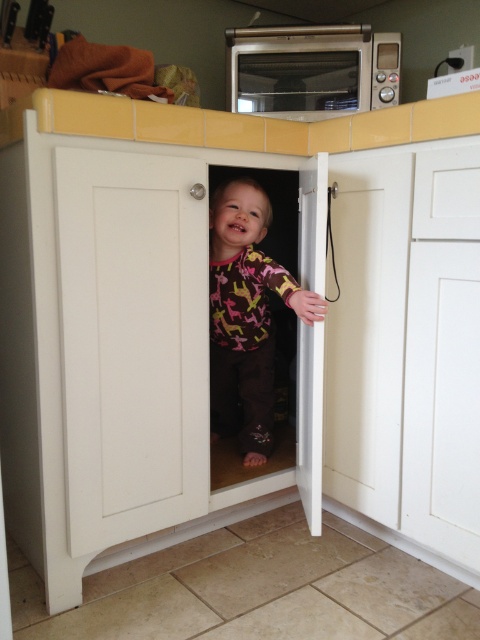
Is multicolored fabric baby at center closer to camera compared to satin silver microwave at upper center?

Yes, it is in front of satin silver microwave at upper center.

Between multicolored fabric baby at center and satin silver microwave at upper center, which one is positioned higher?

satin silver microwave at upper center is higher up.

Which is behind, point (239, 182) or point (250, 67)?

The point (250, 67) is behind.

This screenshot has width=480, height=640. What are the coordinates of `multicolored fabric baby at center` in the screenshot? It's located at (245, 316).

Which is behind, point (78, 512) or point (236, 205)?

The point (236, 205) is behind.

Does white matte cabinet door at center appear on the left side of multicolored fabric baby at center?

Indeed, white matte cabinet door at center is positioned on the left side of multicolored fabric baby at center.

Measure the distance between point (x=202, y=273) and camera.

Point (x=202, y=273) is 1.53 meters from camera.

Where is `white matte cabinet door at center`? This screenshot has height=640, width=480. white matte cabinet door at center is located at coordinates (132, 340).

In the scene shown: Can you confirm if white matte cabinet door at center is smaller than satin silver microwave at upper center?

Actually, white matte cabinet door at center might be larger than satin silver microwave at upper center.

Measure the distance from white matte cabinet door at center to satin silver microwave at upper center.

white matte cabinet door at center and satin silver microwave at upper center are 79.73 centimeters apart from each other.

Is point (177, 177) closer to viewer compared to point (382, 36)?

Yes, it is in front of point (382, 36).

Identify the location of white matte cabinet door at center. This screenshot has width=480, height=640. (132, 340).